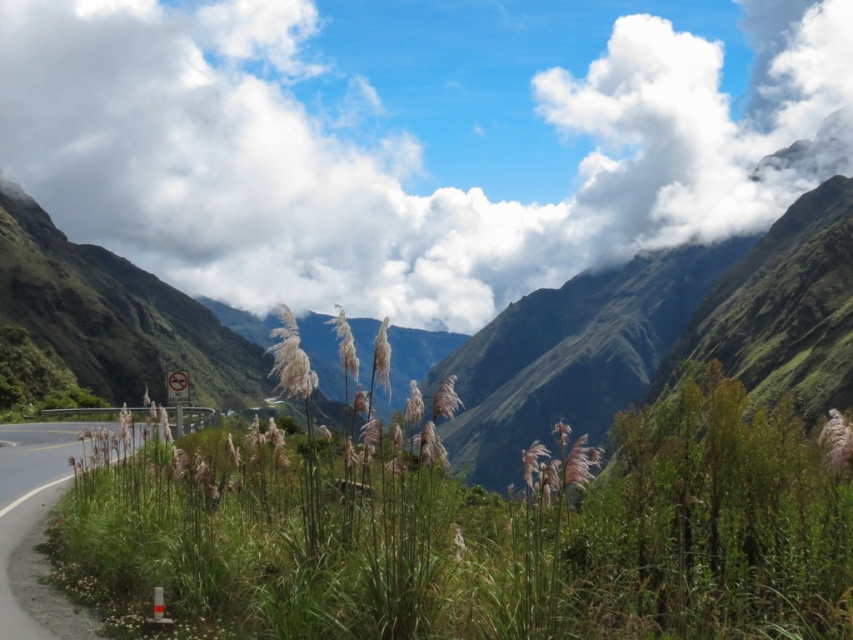
Question: Does white fluffy cloud at upper center have a lesser width compared to green grass at lower left?

Choices:
 (A) no
 (B) yes

Answer: (A)

Question: Does white fluffy cloud at upper center appear over green grass at lower left?

Choices:
 (A) no
 (B) yes

Answer: (B)

Question: Which point appears farthest from the camera in this image?

Choices:
 (A) (144, 230)
 (B) (22, 566)

Answer: (A)

Question: Can you confirm if white fluffy cloud at upper center is positioned above green grass at lower left?

Choices:
 (A) yes
 (B) no

Answer: (A)